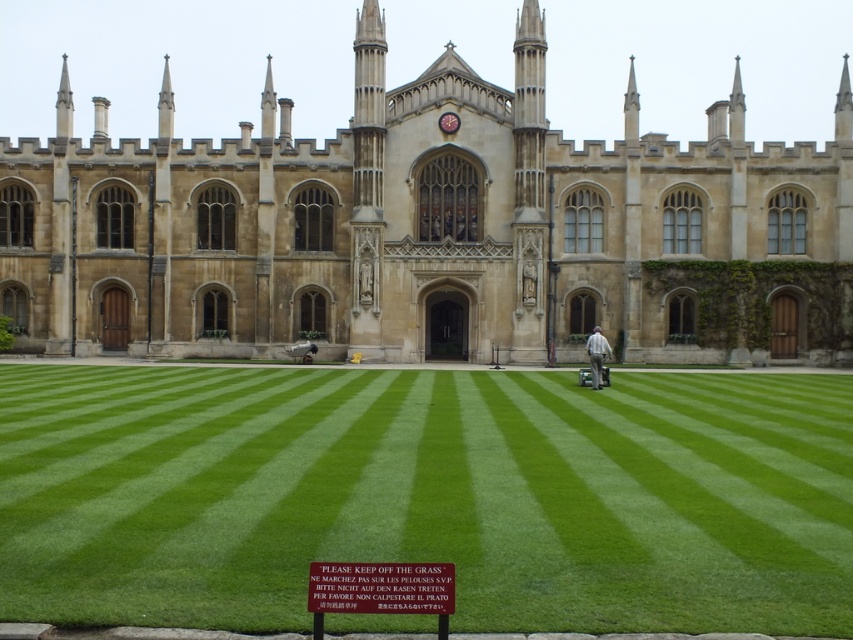
Who is shorter, green smooth lawn at center or light gray fabric at center?

light gray fabric at center

Based on the photo, who is taller, green smooth lawn at center or light gray fabric at center?

With more height is green smooth lawn at center.

Who is more distant from viewer, [415,442] or [593,340]?

Point [593,340]

Locate an element on the screen. Image resolution: width=853 pixels, height=640 pixels. green smooth lawn at center is located at coordinates (426, 493).

Does point (577, 320) lie behind point (225, 408)?

Yes, it is.

Is point (65, 99) less distant than point (158, 400)?

No, it is not.

Describe the element at coordinates (430, 228) in the screenshot. This screenshot has height=640, width=853. I see `brown stone gothic at center` at that location.

Locate an element on the screen. Image resolution: width=853 pixels, height=640 pixels. brown stone gothic at center is located at coordinates (430, 228).

Which is more to the left, brown stone gothic at center or light gray fabric at center?

brown stone gothic at center

Between point (55, 330) and point (595, 387), which one is positioned behind?

Positioned behind is point (55, 330).

Is point (135, 179) farther from camera compared to point (595, 380)?

That is True.

The width and height of the screenshot is (853, 640). Identify the location of brown stone gothic at center. (430, 228).